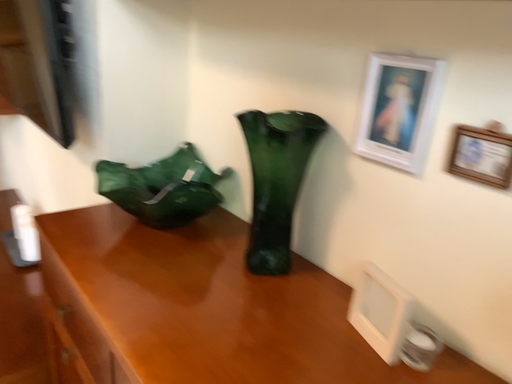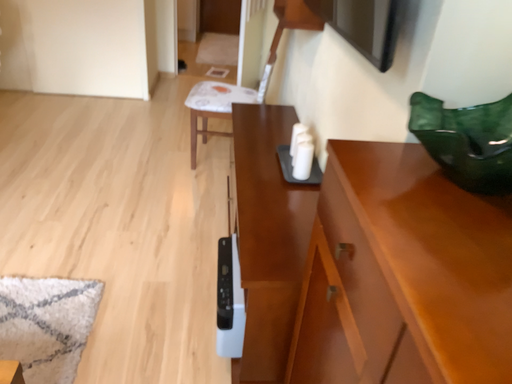
Question: How did the camera likely rotate when shooting the video?

Choices:
 (A) rotated left
 (B) rotated right

Answer: (A)